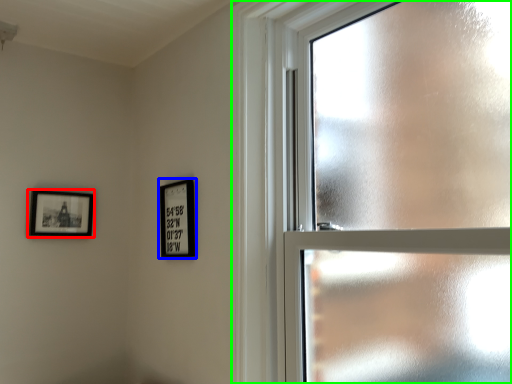
Question: Based on their relative distances, which object is farther from picture frame (highlighted by a red box)? Choose from picture frame (highlighted by a blue box) and window (highlighted by a green box).

Choices:
 (A) picture frame
 (B) window

Answer: (B)